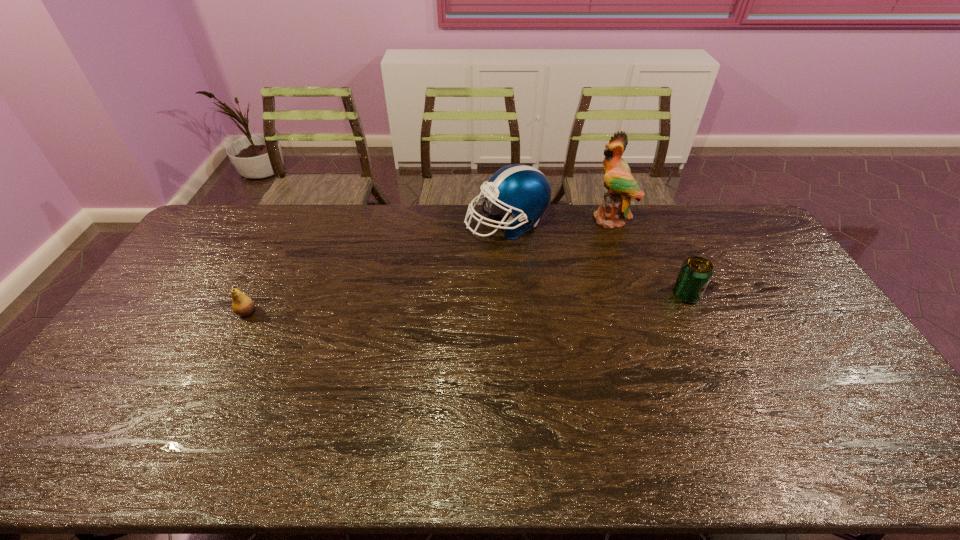
You are a GUI agent. You are given a task and a screenshot of the screen. Output one action in this format:
    pyautogui.click(x=<x>, y=<y>)
    Task: Click on the free point located at the front of the third object from right to left with the faceguard
    This screenshot has width=960, height=540.
    Given the screenshot: What is the action you would take?
    pyautogui.click(x=478, y=260)

This screenshot has height=540, width=960. What are the coordinates of `vacant space located on the front-facing side of the second object from right to left` in the screenshot? It's located at (577, 248).

The image size is (960, 540). Identify the location of vacant region located on the front-facing side of the second object from right to left. (569, 255).

You are a GUI agent. You are given a task and a screenshot of the screen. Output one action in this format:
    pyautogui.click(x=<x>, y=<y>)
    Task: Click on the blank space located on the front-facing side of the second object from right to left
    The image size is (960, 540).
    Given the screenshot: What is the action you would take?
    pyautogui.click(x=557, y=267)

Locate an element on the screen. This screenshot has width=960, height=540. football helmet situated at the far edge is located at coordinates (524, 190).

Locate an element on the screen. This screenshot has width=960, height=540. parrot at the far edge is located at coordinates (621, 186).

In the image, there is a desktop. Where is `free region at the far edge`? The width and height of the screenshot is (960, 540). free region at the far edge is located at coordinates (674, 219).

Image resolution: width=960 pixels, height=540 pixels. In the image, there is a desktop. Identify the location of vacant space at the near edge. (612, 416).

Locate an element on the screen. The height and width of the screenshot is (540, 960). free space at the near left corner of the desktop is located at coordinates (94, 399).

Identify the location of vacant area at the far right corner. (745, 213).